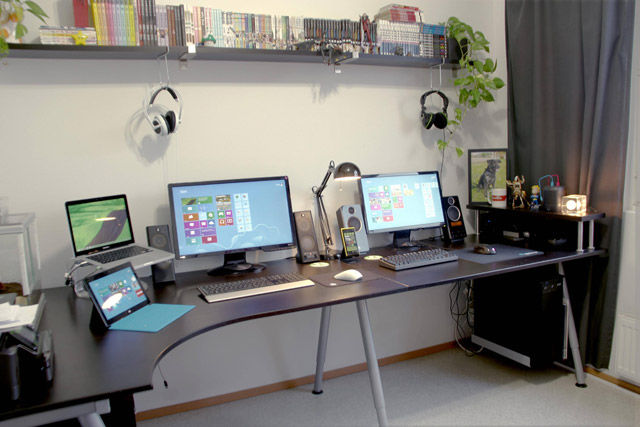
Locate an element on the screen. The height and width of the screenshot is (427, 640). shelf is located at coordinates (138, 50), (227, 52), (381, 58).